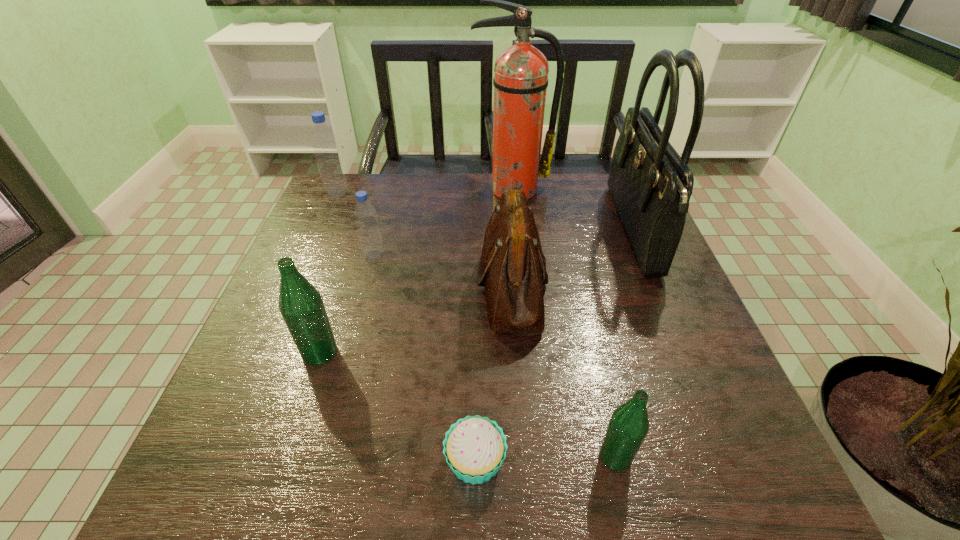
In order to click on fire extinguisher in this screenshot , I will do `click(520, 81)`.

Locate an element on the screen. handbag is located at coordinates (651, 185).

Where is `the rightmost object`? the rightmost object is located at coordinates (651, 185).

Where is `the leftmost object`? The image size is (960, 540). the leftmost object is located at coordinates (324, 142).

Locate an element on the screen. the farther blue bottle is located at coordinates (324, 142).

Locate an element on the screen. Image resolution: width=960 pixels, height=540 pixels. the farther green bottle is located at coordinates point(301,305).

The width and height of the screenshot is (960, 540). Identify the location of the bigger green bottle. (301, 305).

The image size is (960, 540). Find the location of `shoulder bag`. shoulder bag is located at coordinates (512, 267).

The width and height of the screenshot is (960, 540). What are the coordinates of `the nearer blue bottle` in the screenshot? It's located at (365, 215).

The height and width of the screenshot is (540, 960). In order to click on the right blue bottle in this screenshot , I will do `click(365, 215)`.